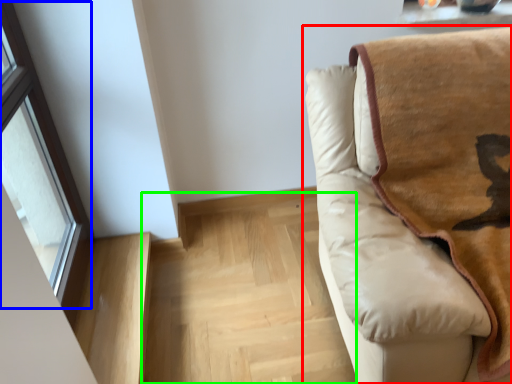
Question: Based on their relative distances, which object is farther from studio couch (highlighted by a red box)? Choose from window (highlighted by a blue box) and stairwell (highlighted by a green box).

Choices:
 (A) window
 (B) stairwell

Answer: (A)